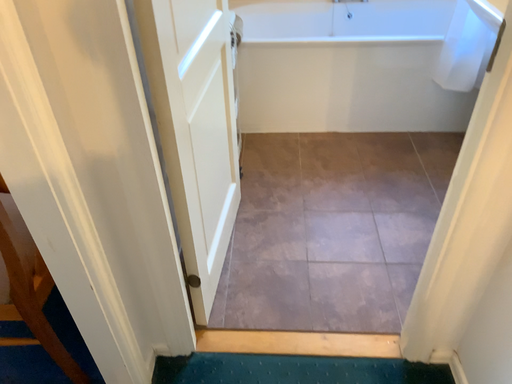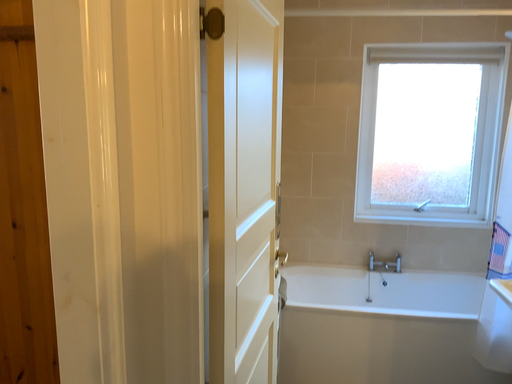
Question: Which way did the camera rotate in the video?

Choices:
 (A) rotated upward
 (B) rotated downward

Answer: (A)